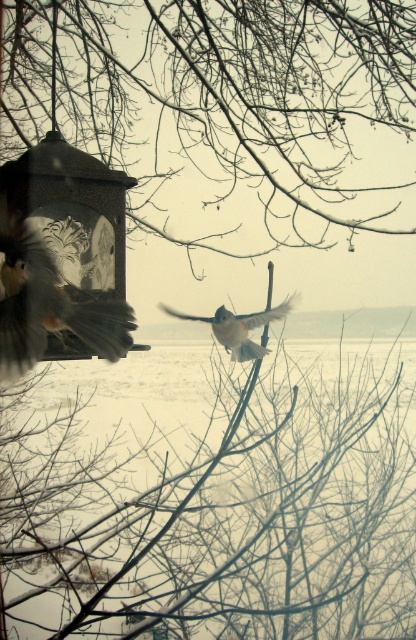
From the picture: Is blurred feathers bird at left smaller than white fluffy bird at center?

No.

Can you confirm if blurred feathers bird at left is bigger than white fluffy bird at center?

Correct, blurred feathers bird at left is larger in size than white fluffy bird at center.

Who is more forward, (x=9, y=307) or (x=240, y=346)?

Positioned in front is point (x=9, y=307).

I want to click on blurred feathers bird at left, so click(x=51, y=308).

Between smooth bark tree at center and blurred feathers bird at left, which one appears on the left side from the viewer's perspective?

blurred feathers bird at left

Is point (244, 179) positioned before point (101, 307)?

No.

The image size is (416, 640). I want to click on smooth bark tree at center, so click(217, 97).

What do you see at coordinates (217, 97) in the screenshot?
I see `smooth bark tree at center` at bounding box center [217, 97].

Can you confirm if smooth bark tree at center is wider than white fluffy bird at center?

Correct, the width of smooth bark tree at center exceeds that of white fluffy bird at center.

Is point (113, 80) in front of point (220, 317)?

No, it is behind (220, 317).

This screenshot has width=416, height=640. Identify the location of smooth bark tree at center. (217, 97).